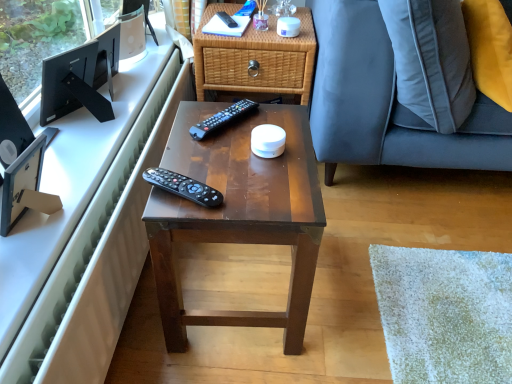
Locate an element on the screen. The height and width of the screenshot is (384, 512). vacant region to the right of black matte monitor at upper left, marked as the first television in a back-to-front arrangement is located at coordinates (116, 125).